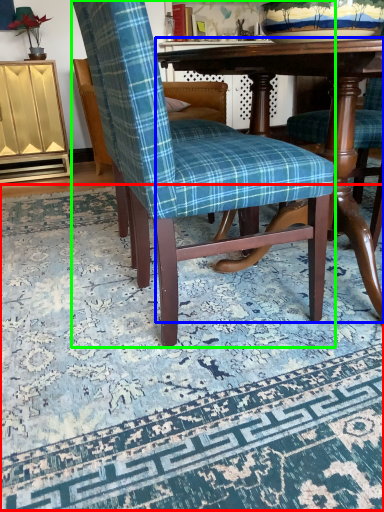
Question: Based on their relative distances, which object is farther from mat (highlighted by a red box)? Choose from table (highlighted by a blue box) and chair (highlighted by a green box).

Choices:
 (A) table
 (B) chair

Answer: (A)